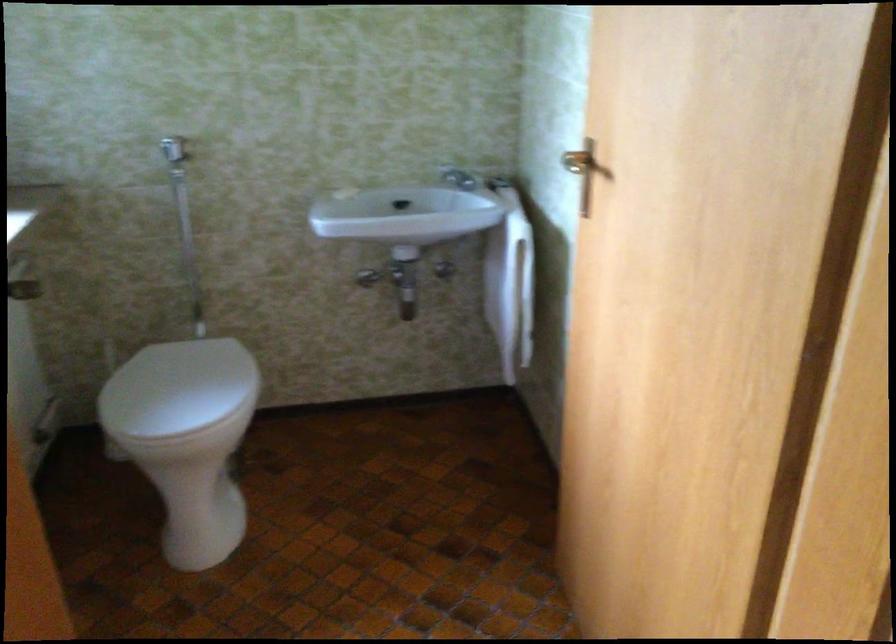
At what (x,y) coordinates should I click in order to perform the action: click on toilet flush handle. Please return your answer as a coordinate pair (x, y). The image size is (896, 644). Looking at the image, I should click on (174, 149).